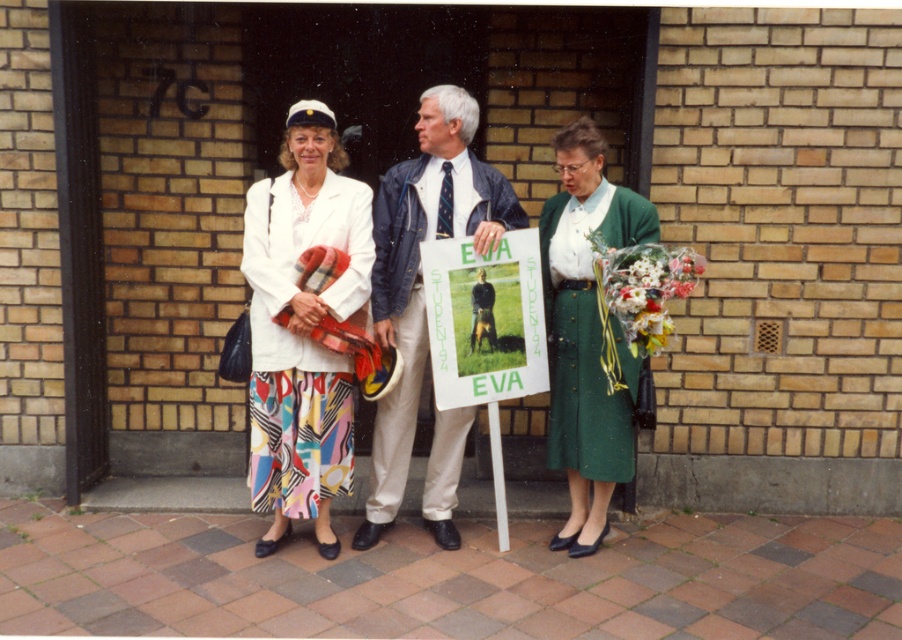
Is denim jacket at center closer to the viewer compared to green paper sign at center?

No, it is not.

Can you confirm if denim jacket at center is positioned to the left of green paper sign at center?

Correct, you'll find denim jacket at center to the left of green paper sign at center.

I want to click on denim jacket at center, so click(x=420, y=269).

Is point (267, 214) closer to camera compared to point (471, 333)?

Yes, point (267, 214) is in front of point (471, 333).

Is the position of white matte jacket at center less distant than that of green paper sign at center?

Yes, white matte jacket at center is closer to the viewer.

At what (x,y) coordinates should I click in order to perform the action: click on white matte jacket at center. Please return your answer as a coordinate pair (x, y). The width and height of the screenshot is (902, 640). Looking at the image, I should click on (302, 328).

Does white cotton jacket at center have a greater width compared to green textured dress at center?

Yes, white cotton jacket at center is wider than green textured dress at center.

Is white cotton jacket at center smaller than green textured dress at center?

Incorrect, white cotton jacket at center is not smaller in size than green textured dress at center.

What do you see at coordinates (419, 269) in the screenshot?
I see `white cotton jacket at center` at bounding box center [419, 269].

At what (x,y) coordinates should I click in order to perform the action: click on white cotton jacket at center. Please return your answer as a coordinate pair (x, y). Looking at the image, I should click on (419, 269).